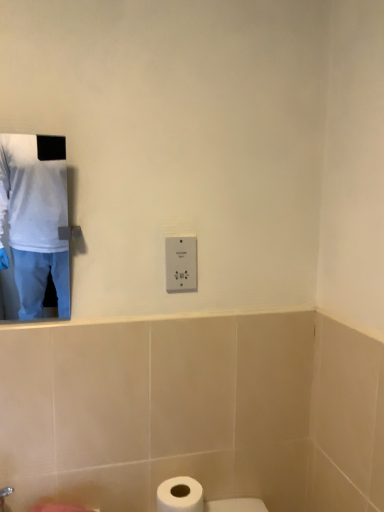
Question: Considering the relative sizes of white plastic switch at center and white matte shirt at upper left in the image provided, is white plastic switch at center bigger than white matte shirt at upper left?

Choices:
 (A) no
 (B) yes

Answer: (A)

Question: Is white plastic switch at center at the left side of white matte shirt at upper left?

Choices:
 (A) yes
 (B) no

Answer: (B)

Question: From a real-world perspective, is white plastic switch at center below white matte shirt at upper left?

Choices:
 (A) no
 (B) yes

Answer: (B)

Question: Is white plastic switch at center positioned far away from white matte shirt at upper left?

Choices:
 (A) yes
 (B) no

Answer: (A)

Question: Is white matte shirt at upper left completely or partially inside white plastic switch at center?

Choices:
 (A) yes
 (B) no

Answer: (B)

Question: Is point (200, 486) closer or farther from the camera than point (165, 283)?

Choices:
 (A) closer
 (B) farther

Answer: (B)

Question: Is white matte toilet paper at lower center bigger or smaller than white plastic switch at center?

Choices:
 (A) big
 (B) small

Answer: (A)

Question: In terms of width, does white matte toilet paper at lower center look wider or thinner when compared to white plastic switch at center?

Choices:
 (A) wide
 (B) thin

Answer: (A)

Question: From the image's perspective, relative to white plastic switch at center, is white matte toilet paper at lower center above or below?

Choices:
 (A) above
 (B) below

Answer: (B)

Question: From the image's perspective, is white plastic switch at center located above or below white matte shirt at upper left?

Choices:
 (A) below
 (B) above

Answer: (A)

Question: Considering the positions of point click(x=178, y=256) and point click(x=11, y=309), is point click(x=178, y=256) closer or farther from the camera than point click(x=11, y=309)?

Choices:
 (A) farther
 (B) closer

Answer: (B)

Question: From a real-world perspective, is white plastic switch at center physically located above or below white matte shirt at upper left?

Choices:
 (A) below
 (B) above

Answer: (A)

Question: Do you think white plastic switch at center is within white matte shirt at upper left, or outside of it?

Choices:
 (A) outside
 (B) inside

Answer: (A)

Question: Does point (177, 288) appear closer or farther from the camera than point (188, 507)?

Choices:
 (A) closer
 (B) farther

Answer: (B)

Question: From a real-world perspective, is white plastic switch at center above or below white matte toilet paper at lower center?

Choices:
 (A) below
 (B) above

Answer: (B)